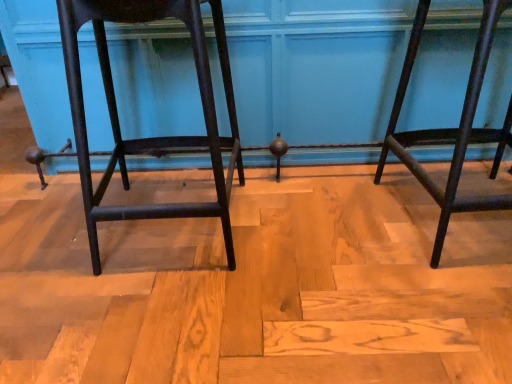
What do you see at coordinates (155, 137) in the screenshot? I see `matte black stool at left, positioned as the 2th furniture in right-to-left order` at bounding box center [155, 137].

Identify the location of matte black stool at left, positioned as the 2th furniture in right-to-left order. Image resolution: width=512 pixels, height=384 pixels. (155, 137).

The width and height of the screenshot is (512, 384). Describe the element at coordinates (451, 128) in the screenshot. I see `matte black stool at right, positioned as the second furniture in left-to-right order` at that location.

Where is `matte black stool at right, positioned as the second furniture in left-to-right order`? This screenshot has width=512, height=384. matte black stool at right, positioned as the second furniture in left-to-right order is located at coordinates (451, 128).

In order to face matte black stool at right, the 1th furniture from the right, should I rotate leftwards or rightwards?

Turn right by 28.919 degrees to look at matte black stool at right, the 1th furniture from the right.

I want to click on matte black stool at left, positioned as the 2th furniture in right-to-left order, so click(155, 137).

Based on the photo, is matte black stool at left, which is the first furniture from left to right, to the left of matte black stool at right, positioned as the second furniture in left-to-right order, from the viewer's perspective?

Yes, matte black stool at left, which is the first furniture from left to right, is to the left of matte black stool at right, positioned as the second furniture in left-to-right order.

Does matte black stool at left, positioned as the 2th furniture in right-to-left order, lie in front of matte black stool at right, positioned as the second furniture in left-to-right order?

Yes, it is.

Between point (71, 59) and point (411, 167), which one is positioned behind?

The point (411, 167) is farther from the camera.

From the image's perspective, which is below, matte black stool at left, which is the first furniture from left to right, or matte black stool at right, positioned as the second furniture in left-to-right order?

From the image's view, matte black stool at left, which is the first furniture from left to right, is below.

From a real-world perspective, relative to matte black stool at right, the 1th furniture from the right, is matte black stool at left, positioned as the 2th furniture in right-to-left order, vertically above or below?

matte black stool at left, positioned as the 2th furniture in right-to-left order, is above matte black stool at right, the 1th furniture from the right.

Is matte black stool at left, which is the first furniture from left to right, wider or thinner than matte black stool at right, positioned as the second furniture in left-to-right order?

Clearly, matte black stool at left, which is the first furniture from left to right, has less width compared to matte black stool at right, positioned as the second furniture in left-to-right order.

Does matte black stool at left, which is the first furniture from left to right, have a greater height compared to matte black stool at right, positioned as the second furniture in left-to-right order?

Correct, matte black stool at left, which is the first furniture from left to right, is much taller as matte black stool at right, positioned as the second furniture in left-to-right order.

Is matte black stool at left, which is the first furniture from left to right, bigger than matte black stool at right, the 1th furniture from the right?

Actually, matte black stool at left, which is the first furniture from left to right, might be smaller than matte black stool at right, the 1th furniture from the right.

Is matte black stool at left, positioned as the 2th furniture in right-to-left order, spatially inside matte black stool at right, positioned as the second furniture in left-to-right order, or outside of it?

matte black stool at left, positioned as the 2th furniture in right-to-left order, is spatially situated outside matte black stool at right, positioned as the second furniture in left-to-right order.

Are matte black stool at left, which is the first furniture from left to right, and matte black stool at right, the 1th furniture from the right, making contact?

No, matte black stool at left, which is the first furniture from left to right, is not beside matte black stool at right, the 1th furniture from the right.

Is matte black stool at left, which is the first furniture from left to right, oriented away from matte black stool at right, the 1th furniture from the right?

No, matte black stool at left, which is the first furniture from left to right, is not facing away from matte black stool at right, the 1th furniture from the right.

Could you measure the distance between matte black stool at left, positioned as the 2th furniture in right-to-left order, and matte black stool at right, positioned as the second furniture in left-to-right order?

They are 29.00 inches apart.

The width and height of the screenshot is (512, 384). Find the location of `furniture above the matte black stool at left, which is the first furniture from left to right (from the image's perspective)`. furniture above the matte black stool at left, which is the first furniture from left to right (from the image's perspective) is located at coordinates (451, 128).

Can you confirm if matte black stool at right, positioned as the second furniture in left-to-right order, is positioned to the right of matte black stool at left, which is the first furniture from left to right?

Correct, you'll find matte black stool at right, positioned as the second furniture in left-to-right order, to the right of matte black stool at left, which is the first furniture from left to right.

Between matte black stool at right, positioned as the second furniture in left-to-right order, and matte black stool at left, which is the first furniture from left to right, which one is positioned behind?

Positioned behind is matte black stool at right, positioned as the second furniture in left-to-right order.

Between point (423, 144) and point (194, 18), which one is positioned in front?

The point (194, 18) is closer to the camera.

From the image's perspective, which one is positioned higher, matte black stool at right, positioned as the second furniture in left-to-right order, or matte black stool at left, positioned as the 2th furniture in right-to-left order?

matte black stool at right, positioned as the second furniture in left-to-right order, from the image's perspective.

From a real-world perspective, between matte black stool at right, positioned as the second furniture in left-to-right order, and matte black stool at left, which is the first furniture from left to right, who is vertically lower?

In real-world perspective, matte black stool at right, positioned as the second furniture in left-to-right order, is lower.

Which object is thinner, matte black stool at right, the 1th furniture from the right, or matte black stool at left, positioned as the 2th furniture in right-to-left order?

matte black stool at left, positioned as the 2th furniture in right-to-left order.

Can you confirm if matte black stool at right, positioned as the second furniture in left-to-right order, is shorter than matte black stool at left, positioned as the 2th furniture in right-to-left order?

Yes, matte black stool at right, positioned as the second furniture in left-to-right order, is shorter than matte black stool at left, positioned as the 2th furniture in right-to-left order.

Between matte black stool at right, positioned as the second furniture in left-to-right order, and matte black stool at left, positioned as the 2th furniture in right-to-left order, which one has smaller size?

With smaller size is matte black stool at left, positioned as the 2th furniture in right-to-left order.

Could matte black stool at left, which is the first furniture from left to right, be considered to be inside matte black stool at right, positioned as the second furniture in left-to-right order?

No.

Are matte black stool at right, positioned as the second furniture in left-to-right order, and matte black stool at left, which is the first furniture from left to right, located far from each other?

No, matte black stool at right, positioned as the second furniture in left-to-right order, is not far away from matte black stool at left, which is the first furniture from left to right.

Is matte black stool at right, positioned as the second furniture in left-to-right order, aimed at matte black stool at left, positioned as the 2th furniture in right-to-left order?

No, matte black stool at right, positioned as the second furniture in left-to-right order, does not turn towards matte black stool at left, positioned as the 2th furniture in right-to-left order.

How different are the orientations of matte black stool at right, the 1th furniture from the right, and matte black stool at left, positioned as the 2th furniture in right-to-left order, in degrees?

The angular difference between matte black stool at right, the 1th furniture from the right, and matte black stool at left, positioned as the 2th furniture in right-to-left order, is 0.000982 degrees.

In the image, there is a matte black stool at left, positioned as the 2th furniture in right-to-left order. Where is `furniture below it (from a real-world perspective)`? furniture below it (from a real-world perspective) is located at coordinates (451, 128).

Identify the location of furniture below the matte black stool at right, the 1th furniture from the right (from the image's perspective). click(x=155, y=137).

Where is `furniture on the right of matte black stool at left, which is the first furniture from left to right`? This screenshot has height=384, width=512. furniture on the right of matte black stool at left, which is the first furniture from left to right is located at coordinates (451, 128).